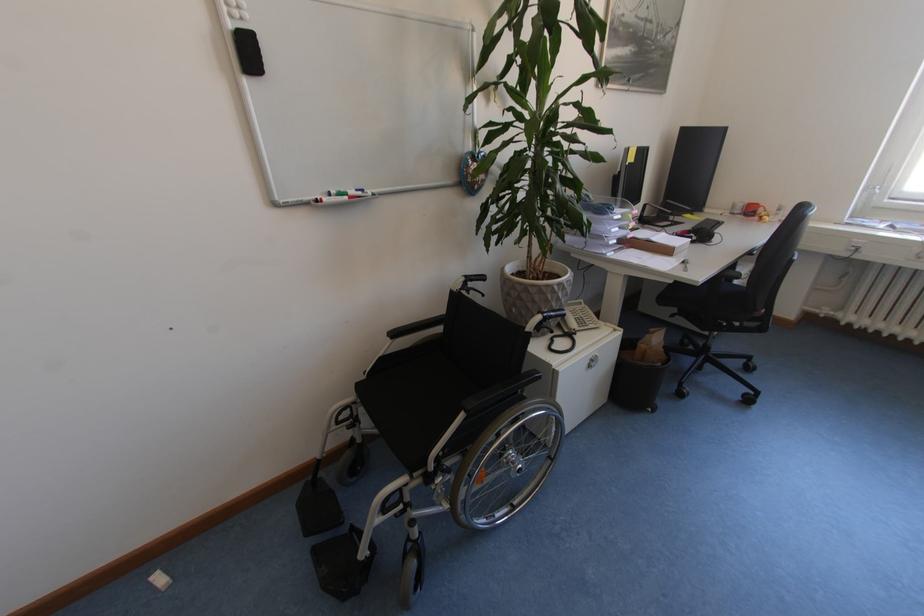
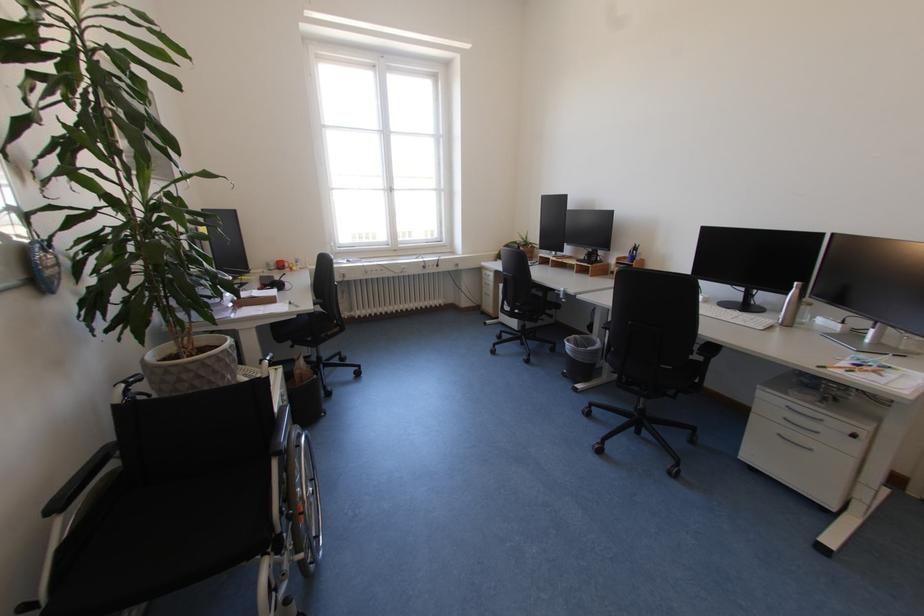
Question: The camera is either moving clockwise (left) or counter-clockwise (right) around the object. The first image is from the beginning of the video and the second image is from the end. Is the camera moving left or right when shooting the video?

Choices:
 (A) Left
 (B) Right

Answer: (A)